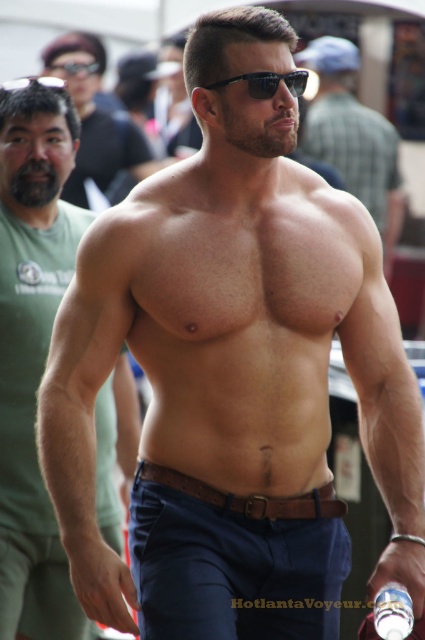
Is point (108, 152) closer to camera compared to point (278, 77)?

No, (108, 152) is further to viewer.

At what (x,y) coordinates should I click in order to perform the action: click on matte black sunglasses at upper center. Please return your answer as a coordinate pair (x, y). The width and height of the screenshot is (425, 640). Looking at the image, I should click on (95, 118).

Image resolution: width=425 pixels, height=640 pixels. Identify the location of matte black sunglasses at upper center. (95, 118).

Who is more forward, (31, 100) or (274, 516)?

Point (274, 516)

Is matte brown belt at center closer to camera compared to brown leather belt at center?

No, it is not.

Is point (31, 264) positioned behind point (229, 506)?

Yes, it is.

This screenshot has height=640, width=425. What are the coordinates of `matte brown belt at center` in the screenshot? It's located at (33, 348).

Who is more distant from viewer, (x=172, y=483) or (x=258, y=92)?

The point (x=172, y=483) is behind.

Describe the element at coordinates (249, 497) in the screenshot. I see `brown leather belt at center` at that location.

Find the location of a particular element. The image size is (425, 640). brown leather belt at center is located at coordinates (249, 497).